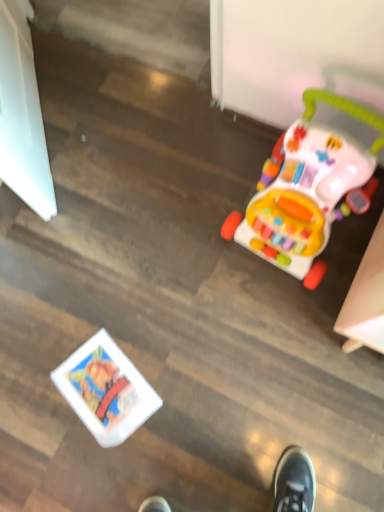
Where is `unoccupied space behind white glossy book at lower left, arranged as the first toy when viewed from the left`? Image resolution: width=384 pixels, height=512 pixels. unoccupied space behind white glossy book at lower left, arranged as the first toy when viewed from the left is located at coordinates (99, 309).